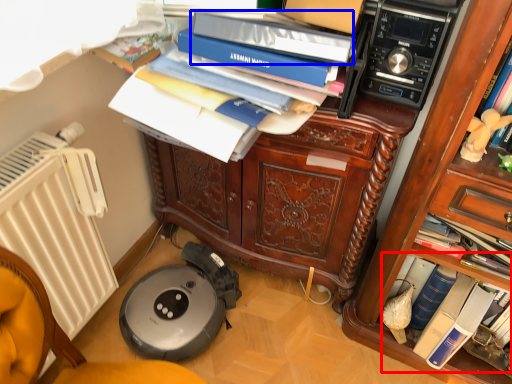
Question: Which of the following is the farthest to the observer, book (highlighted by a red box) or bin (highlighted by a blue box)?

Choices:
 (A) book
 (B) bin

Answer: (A)